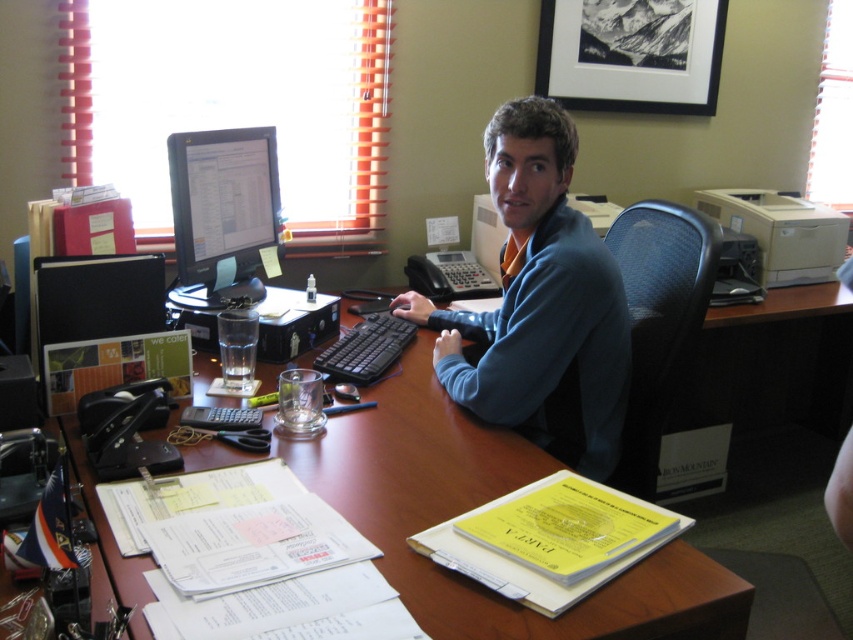
Question: Among these objects, which one is nearest to the camera?

Choices:
 (A) matte black monitor at center
 (B) blue cotton shirt at center

Answer: (B)

Question: Which point is farther to the camera?

Choices:
 (A) (491, 356)
 (B) (663, 556)

Answer: (A)

Question: Can you confirm if brown wood computer desk at center is wider than matte black monitor at center?

Choices:
 (A) no
 (B) yes

Answer: (B)

Question: From the image, what is the correct spatial relationship of brown wood computer desk at center in relation to blue cotton shirt at center?

Choices:
 (A) right
 (B) left

Answer: (B)

Question: Which point is closer to the camera?

Choices:
 (A) matte black monitor at center
 (B) brown wood computer desk at center

Answer: (B)

Question: Can you confirm if blue cotton shirt at center is positioned to the right of matte black monitor at center?

Choices:
 (A) no
 (B) yes

Answer: (B)